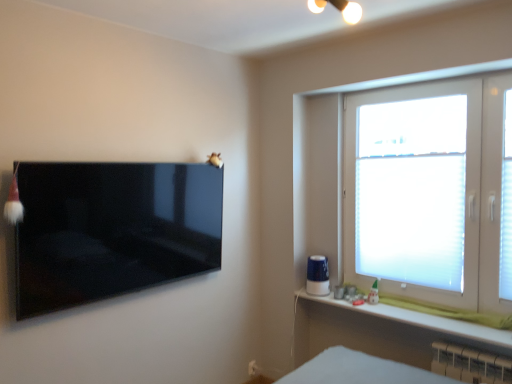
Question: Considering the positions of point (249, 374) and point (439, 362), is point (249, 374) closer or farther from the camera than point (439, 362)?

Choices:
 (A) farther
 (B) closer

Answer: (A)

Question: In terms of size, does white plastic electric outlet at lower center appear bigger or smaller than white plastic radiator at lower right?

Choices:
 (A) big
 (B) small

Answer: (B)

Question: Which object is positioned closest to the white frosted glass window at right?

Choices:
 (A) white matte window sill at lower right
 (B) glossy black tv at left
 (C) white plastic electric outlet at lower center
 (D) white translucent blinds at right
 (E) white plastic radiator at lower right

Answer: (D)

Question: Based on their relative distances, which object is nearer to the white plastic electric outlet at lower center?

Choices:
 (A) glossy black tv at left
 (B) white frosted glass window at right
 (C) white translucent blinds at right
 (D) white plastic radiator at lower right
 (E) white matte window sill at lower right

Answer: (E)